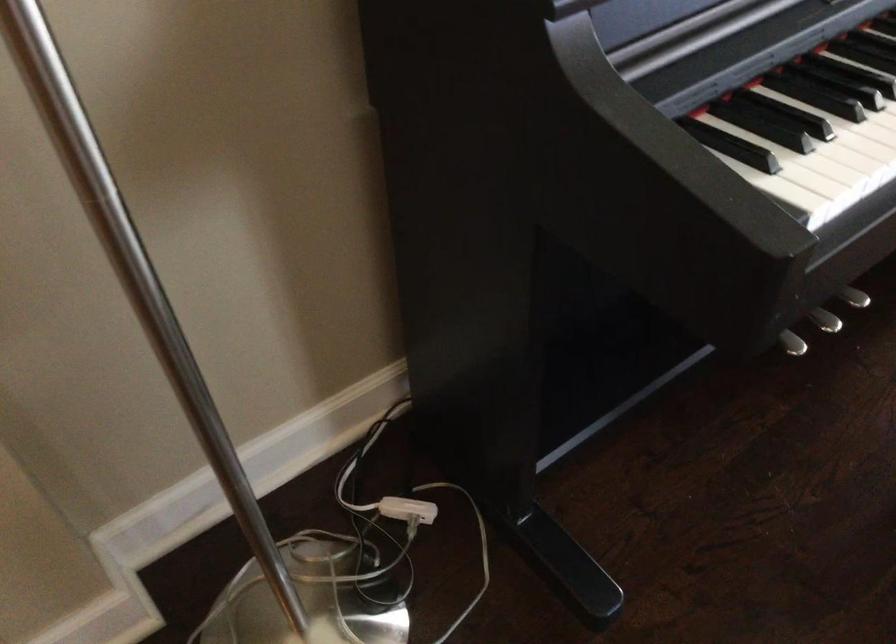
This screenshot has width=896, height=644. In order to click on black piano key in this screenshot , I will do `click(799, 100)`.